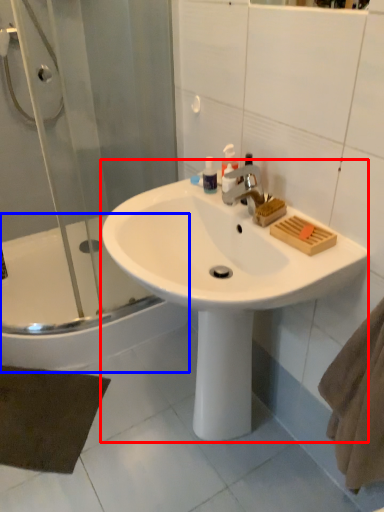
Question: Which object is closer to the camera taking this photo, sink (highlighted by a red box) or bathtub (highlighted by a blue box)?

Choices:
 (A) sink
 (B) bathtub

Answer: (A)